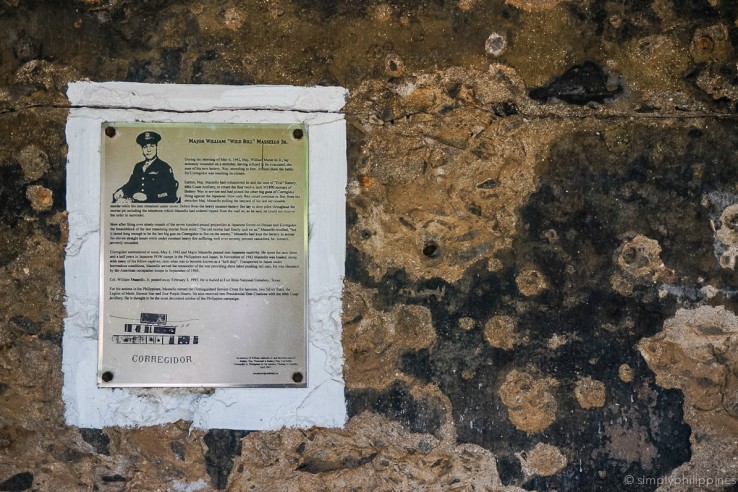
The height and width of the screenshot is (492, 738). Find the location of `right edge of the poster`. right edge of the poster is located at coordinates click(317, 216).